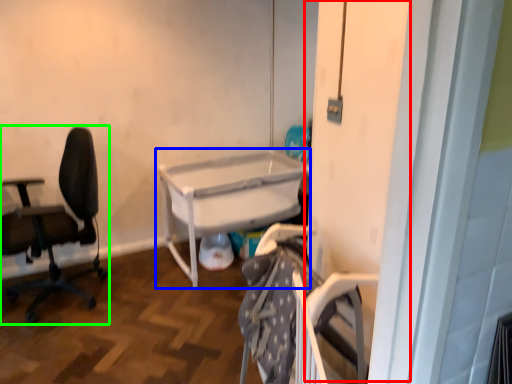
Question: Considering the real-world distances, which object is closest to screen door (highlighted by a red box)? table (highlighted by a blue box) or chair (highlighted by a green box).

Choices:
 (A) table
 (B) chair

Answer: (A)